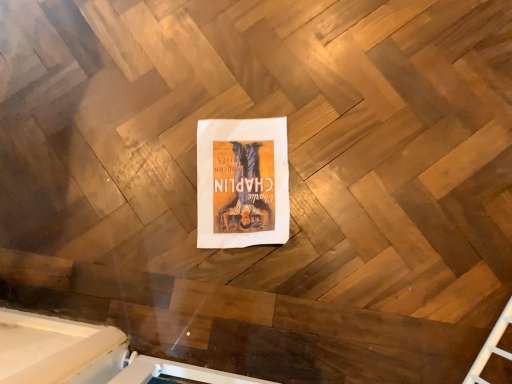
Locate an element on the screen. vacant space situated above white paper poster at center (from a real-world perspective) is located at coordinates (240, 178).